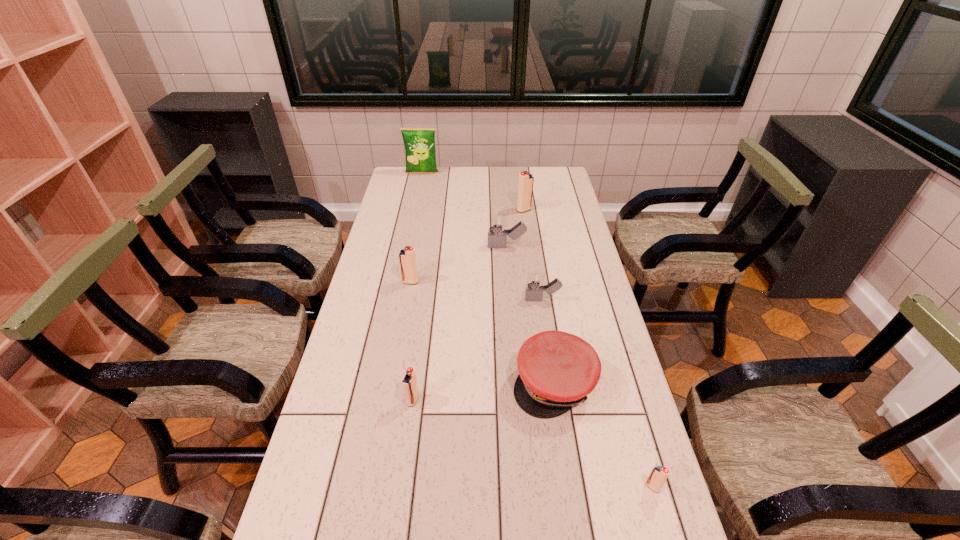
Identify the location of igniter object that ranks as the second closest to the tallest object. (497, 238).

Select which igniter is the sixth closest to the leftmost red igniter. Please provide its 2D coordinates. Your answer should be formatted as a tuple, i.e. [(x, y)], where the tuple contains the x and y coordinates of a point satisfying the conditions above.

[(659, 474)]

The height and width of the screenshot is (540, 960). Identify the location of red igniter that is the fourth closest to the seventh nearest object. (659, 474).

This screenshot has height=540, width=960. I want to click on red igniter that is the second closest to the sixth nearest object, so click(525, 186).

This screenshot has height=540, width=960. Find the location of `gray igniter object that ranks as the second closest to the fourth nearest igniter`. gray igniter object that ranks as the second closest to the fourth nearest igniter is located at coordinates (409, 539).

Image resolution: width=960 pixels, height=540 pixels. In order to click on gray igniter object that ranks as the closest to the second farthest igniter in this screenshot , I will do (535, 281).

Where is `free spot that satisfies the following two spatial constraints: 1. on the front-facing side of the third farthest igniter; 2. on the right side of the crisp (potato chip)`? free spot that satisfies the following two spatial constraints: 1. on the front-facing side of the third farthest igniter; 2. on the right side of the crisp (potato chip) is located at coordinates (399, 282).

The height and width of the screenshot is (540, 960). What are the coordinates of `vacant space that satisfies the following two spatial constraints: 1. on the front-facing side of the smallest red igniter; 2. on the left side of the cap` in the screenshot? It's located at (569, 487).